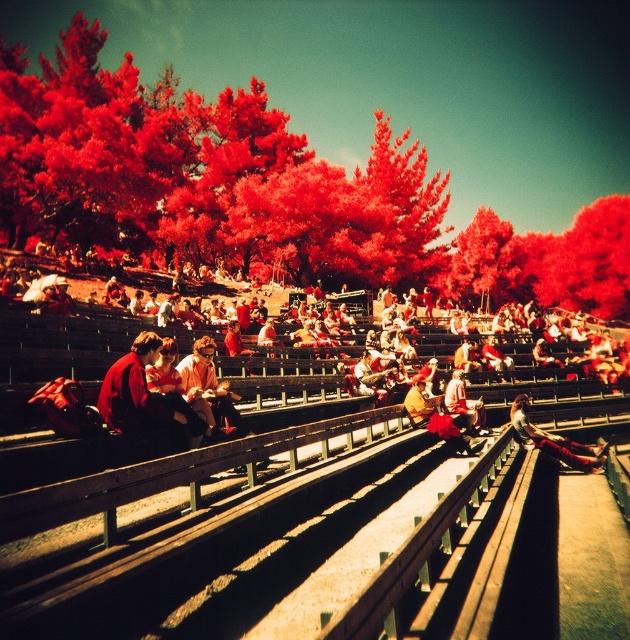
Question: Does matte red backpack at center have a lesser width compared to matte red jacket at center?

Choices:
 (A) yes
 (B) no

Answer: (B)

Question: Which point is closer to the camera?

Choices:
 (A) matte red jacket at left
 (B) matte red jacket at center
 (C) denim pants at lower right
 (D) matte pink hoodie at center

Answer: (A)

Question: Which of the following is the closest to the observer?

Choices:
 (A) (518, 266)
 (B) (224, 403)
 (C) (571, 248)
 (D) (173, 404)

Answer: (D)

Question: Can you confirm if red textured trees at upper left is positioned below matte red jacket at center?

Choices:
 (A) yes
 (B) no

Answer: (B)

Question: Is red matte tree at upper right smaller than matte red jacket at center?

Choices:
 (A) yes
 (B) no

Answer: (B)

Question: Which point appears closest to the camera in this image?

Choices:
 (A) (598, 268)
 (B) (30, 317)
 (C) (518, 397)
 (D) (512, 237)

Answer: (B)